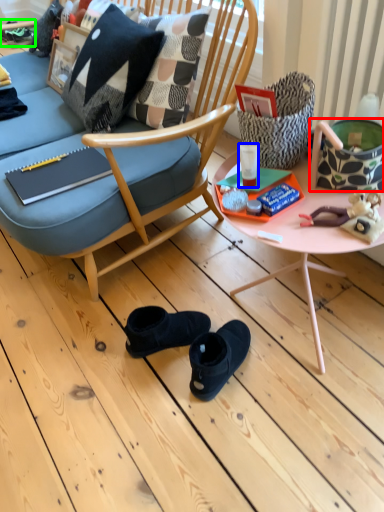
Question: Which object is the closest to the handbag (highlighted by a red box)? Choose among these: coffee cup (highlighted by a blue box) or footwear (highlighted by a green box).

Choices:
 (A) coffee cup
 (B) footwear

Answer: (A)